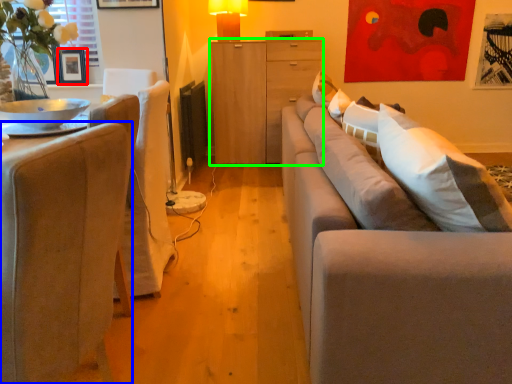
Question: Estimate the real-world distances between objects in this image. Which object is farther from picture frame (highlighted by a red box), chair (highlighted by a blue box) or cabinetry (highlighted by a green box)?

Choices:
 (A) chair
 (B) cabinetry

Answer: (A)